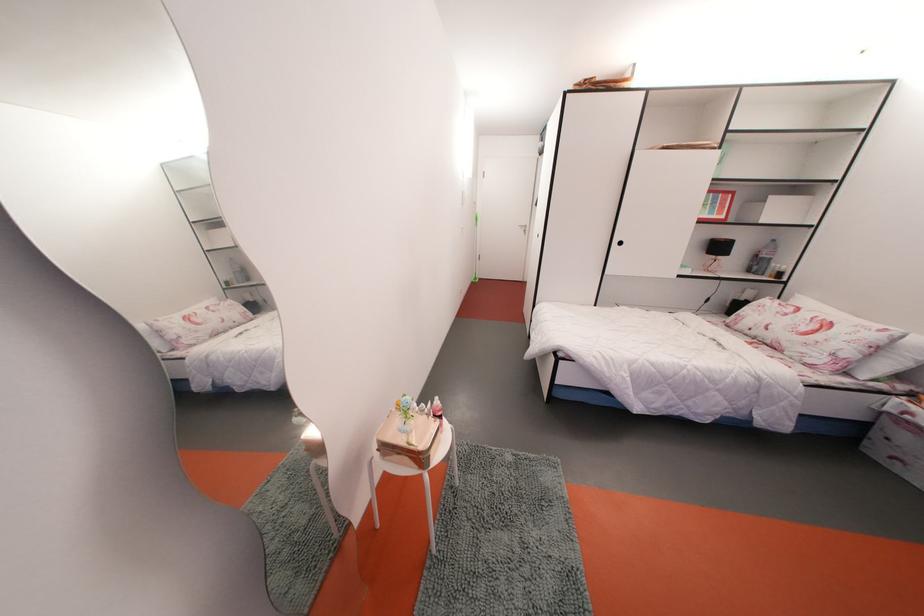
The location [763,257] corresponds to which object?

It refers to a plastic water bottle.